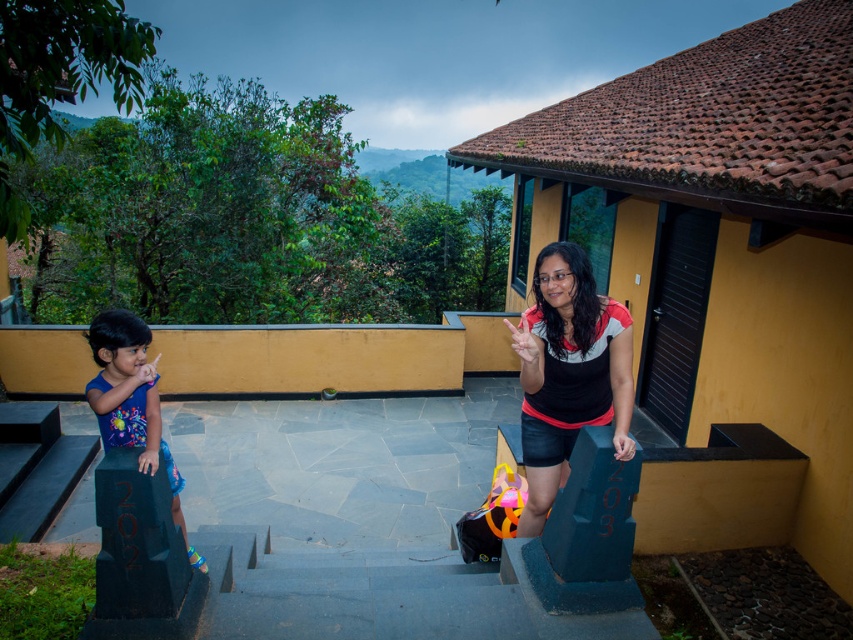
Question: Which point is farther from the camera taking this photo?

Choices:
 (A) (137, 595)
 (B) (541, 472)
 (C) (128, 428)

Answer: (B)

Question: Can you confirm if matte black shirt at center is positioned to the right of matte blue dress at left?

Choices:
 (A) no
 (B) yes

Answer: (B)

Question: Is black polished stone pillar at lower left closer to the viewer compared to matte blue dress at left?

Choices:
 (A) yes
 (B) no

Answer: (A)

Question: Does matte black shirt at center appear under matte blue dress at left?

Choices:
 (A) no
 (B) yes

Answer: (A)

Question: Which object appears farthest from the camera in this image?

Choices:
 (A) matte blue dress at left
 (B) matte black shirt at center
 (C) black polished stone pillar at lower left

Answer: (B)

Question: Among these points, which one is farthest from the camera?

Choices:
 (A) (99, 380)
 (B) (581, 406)
 (C) (117, 522)

Answer: (B)